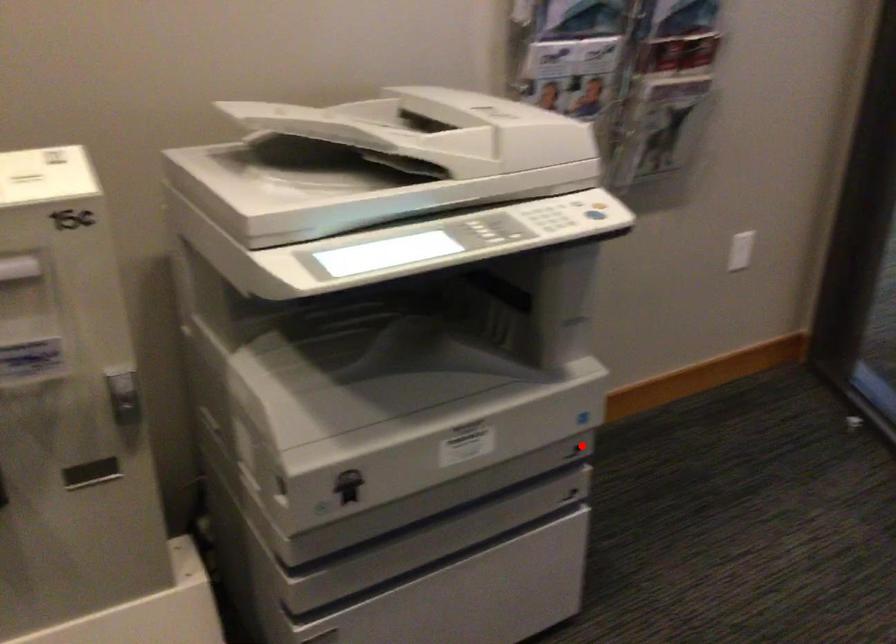
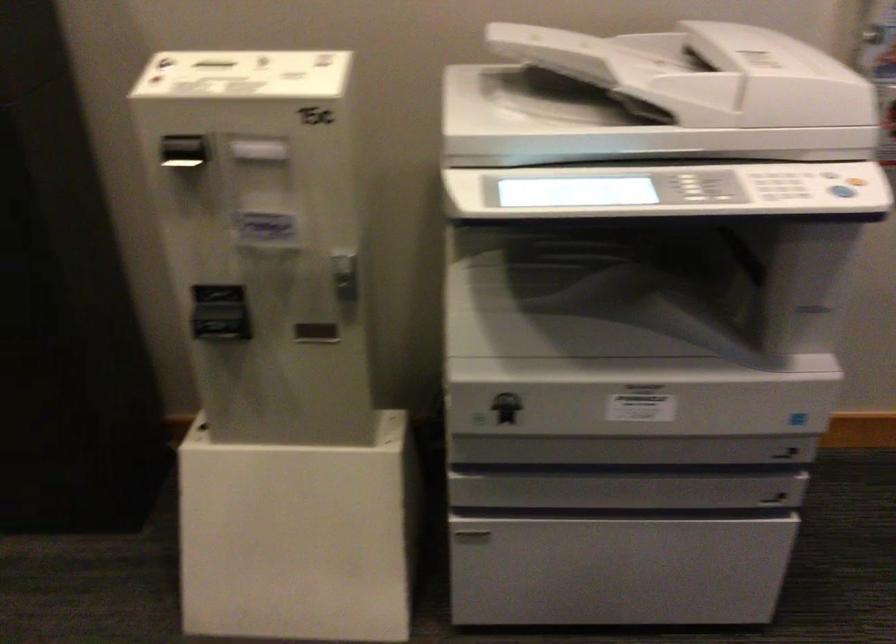
Question: I am providing you with two images of the same scene from different viewpoints. A red point is shown in image1. For the corresponding object point in image2, is it positioned nearer or farther from the camera?

Choices:
 (A) Nearer
 (B) Farther

Answer: (A)